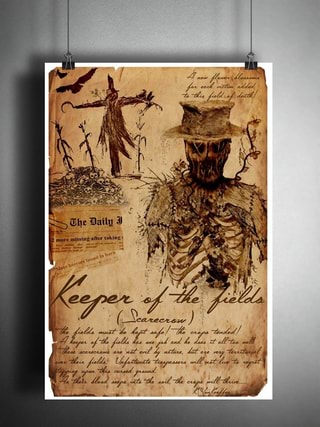
The image size is (320, 427). What are the coordinates of `wall` in the screenshot? It's located at 66,63, 251,68, 308,120.